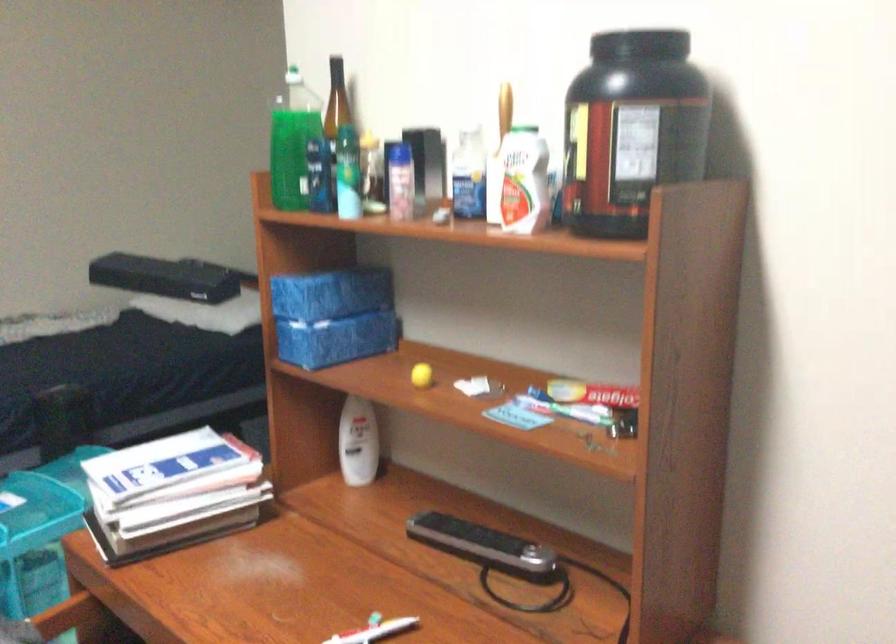
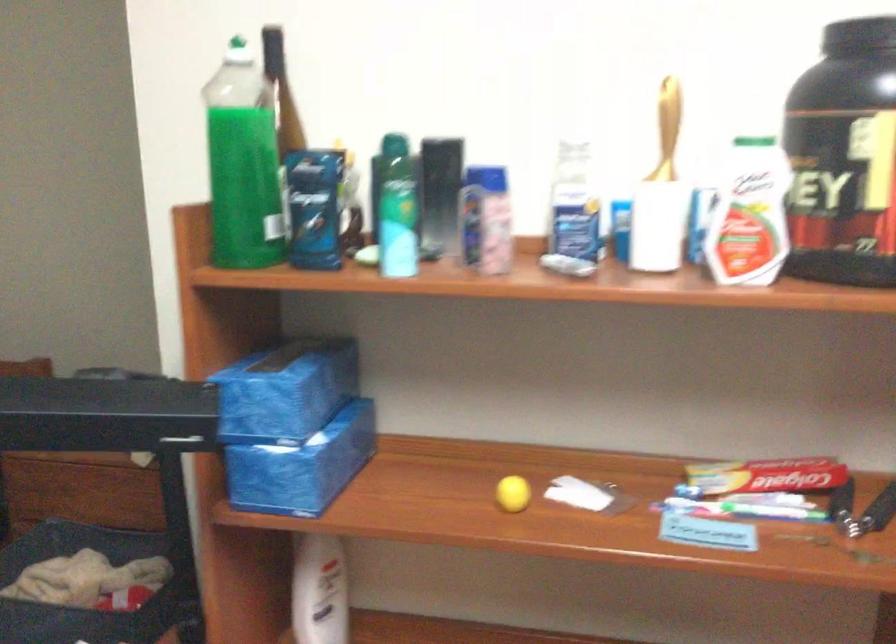
The point at (504,113) is marked in the first image. Where is the corresponding point in the second image?

(668, 118)